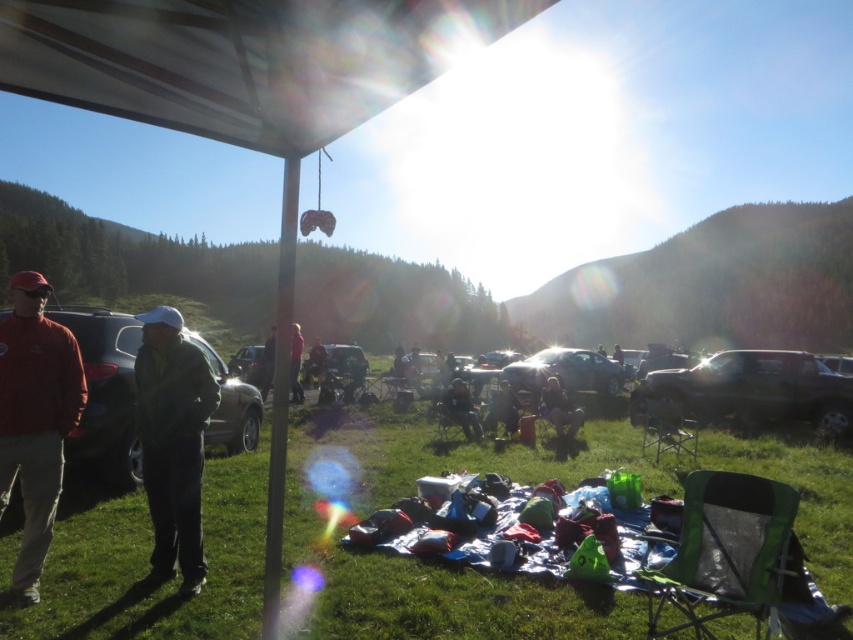
Question: Can you confirm if shiny black truck at right is positioned below metallic silver car at center?

Choices:
 (A) no
 (B) yes

Answer: (A)

Question: Which point appears closest to the camera in this image?

Choices:
 (A) (163, 401)
 (B) (94, 426)

Answer: (A)

Question: Which of the following is the farthest from the observer?

Choices:
 (A) (531, 365)
 (B) (7, 454)
 (C) (292, 356)
 (D) (694, 378)

Answer: (A)

Question: Which object appears farthest from the camera in this image?

Choices:
 (A) matte red shirt at left
 (B) green matte jacket at left
 (C) metallic silver car at center

Answer: (C)

Question: Is shiny black truck at right to the right of pink fabric at center from the viewer's perspective?

Choices:
 (A) yes
 (B) no

Answer: (A)

Question: Observing the image, what is the correct spatial positioning of green grass at lower center in reference to satin silver car at center?

Choices:
 (A) below
 (B) above

Answer: (A)